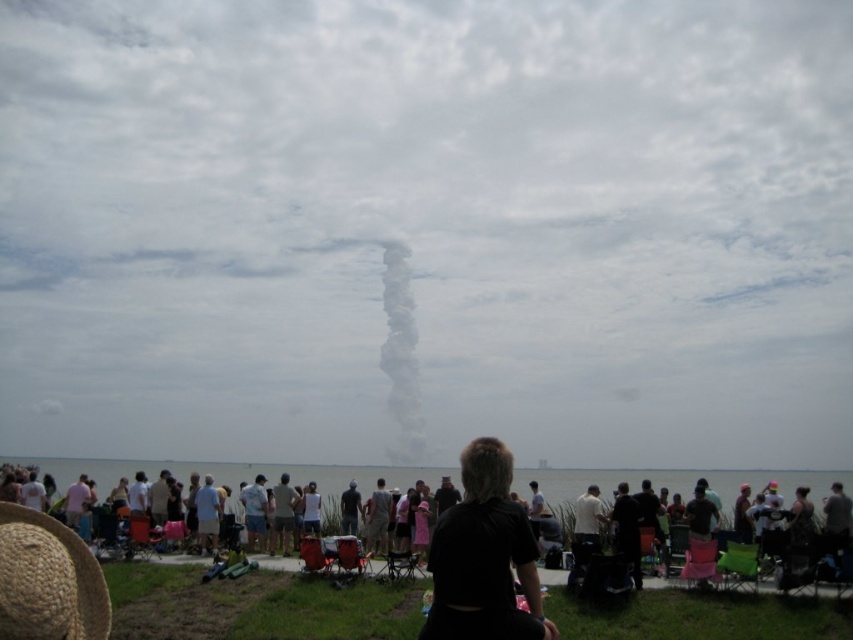
Which of these two, black fabric at center or white fluffy smoke at center, stands taller?

white fluffy smoke at center is taller.

Is black fabric at center wider than white fluffy smoke at center?

Yes, black fabric at center is wider than white fluffy smoke at center.

Is point (511, 512) positioned after point (405, 451)?

That is False.

In order to click on black fabric at center in this screenshot , I will do `click(485, 556)`.

Does light brown fabric pants at center have a larger size compared to dark gray shirt at center?

Yes, light brown fabric pants at center is bigger than dark gray shirt at center.

Image resolution: width=853 pixels, height=640 pixels. In order to click on light brown fabric pants at center in this screenshot , I will do `click(282, 515)`.

Who is more distant from viewer, (283,481) or (347,529)?

The point (347,529) is behind.

Find the location of a particular element. This screenshot has width=853, height=640. light brown fabric pants at center is located at coordinates (282, 515).

Consider the image. Which is more to the right, white smoke plume at center or black fabric at center?

Positioned to the right is black fabric at center.

Can you confirm if white smoke plume at center is positioned to the left of black fabric at center?

Indeed, white smoke plume at center is positioned on the left side of black fabric at center.

Locate an element on the screen. The height and width of the screenshot is (640, 853). white smoke plume at center is located at coordinates (427, 228).

In order to click on white smoke plume at center in this screenshot , I will do `click(427, 228)`.